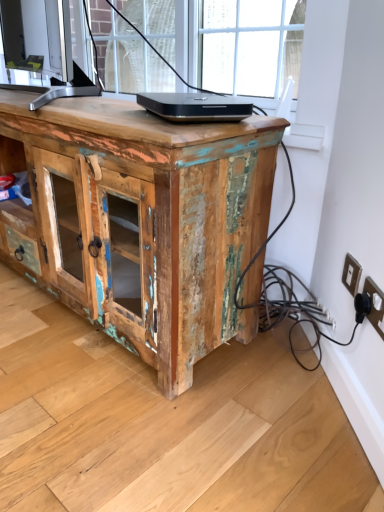
Question: Is point pyautogui.click(x=160, y=346) closer or farther from the camera than point pyautogui.click(x=203, y=98)?

Choices:
 (A) farther
 (B) closer

Answer: (B)

Question: Is weathered wood cabinet at center wider or thinner than black glossy laptop at center?

Choices:
 (A) thin
 (B) wide

Answer: (B)

Question: Estimate the real-world distances between objects in this image. Which object is farther from the black glossy laptop at center?

Choices:
 (A) weathered wood cabinet at center
 (B) white plastic electric outlet at lower right, the second electric outlet when ordered from front to back
 (C) black plastic electric outlet at lower right, the 2th electric outlet positioned from the back

Answer: (C)

Question: Estimate the real-world distances between objects in this image. Which object is farther from the weathered wood cabinet at center?

Choices:
 (A) black glossy laptop at center
 (B) white plastic electric outlet at lower right, the second electric outlet when ordered from front to back
 (C) black plastic electric outlet at lower right, the first electric outlet positioned from the front

Answer: (C)